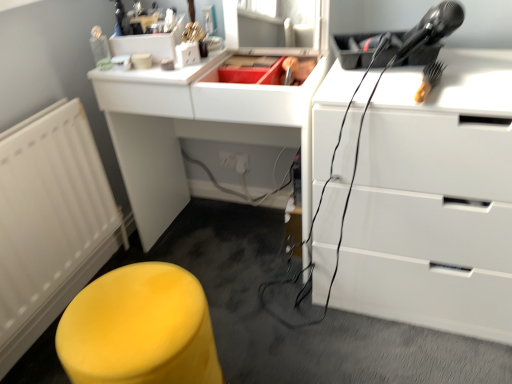
Locate an element on the screen. vacant space to the right of yellow plastic brush at upper right is located at coordinates (467, 81).